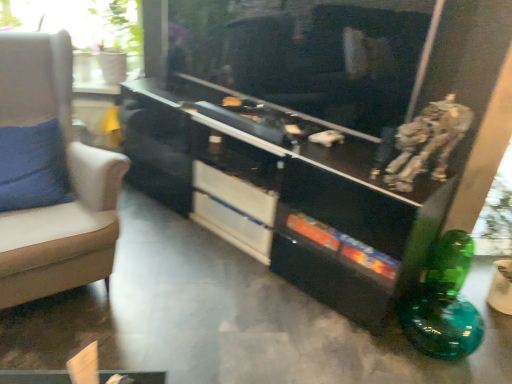
Question: Does white glossy drawer at center, arranged as the first drawer when ordered from the bottom, come in front of metallic silver robot at upper right?

Choices:
 (A) yes
 (B) no

Answer: (B)

Question: From the image's perspective, does white glossy drawer at center, arranged as the first drawer when ordered from the bottom, appear lower than metallic silver robot at upper right?

Choices:
 (A) yes
 (B) no

Answer: (A)

Question: From the image's perspective, is white glossy drawer at center, arranged as the first drawer when ordered from the bottom, located above metallic silver robot at upper right?

Choices:
 (A) no
 (B) yes

Answer: (A)

Question: Can you confirm if white glossy drawer at center, the second drawer viewed from the top, is thinner than metallic silver robot at upper right?

Choices:
 (A) no
 (B) yes

Answer: (B)

Question: Is white glossy drawer at center, arranged as the first drawer when ordered from the bottom, facing towards metallic silver robot at upper right?

Choices:
 (A) no
 (B) yes

Answer: (A)

Question: Does white glossy drawer at center, the second drawer viewed from the top, touch metallic silver robot at upper right?

Choices:
 (A) no
 (B) yes

Answer: (A)

Question: Does white glossy drawer at center, arranged as the 2th drawer when ordered from the bottom, have a lesser width compared to beige fabric chair at left?

Choices:
 (A) no
 (B) yes

Answer: (B)

Question: Is white glossy drawer at center, arranged as the 2th drawer when ordered from the bottom, facing away from beige fabric chair at left?

Choices:
 (A) yes
 (B) no

Answer: (B)

Question: Considering the relative sizes of white glossy drawer at center, which is the first drawer from top to bottom, and beige fabric chair at left in the image provided, is white glossy drawer at center, which is the first drawer from top to bottom, bigger than beige fabric chair at left?

Choices:
 (A) no
 (B) yes

Answer: (A)

Question: Is white glossy drawer at center, arranged as the 2th drawer when ordered from the bottom, not near beige fabric chair at left?

Choices:
 (A) yes
 (B) no

Answer: (B)

Question: Can you confirm if white glossy drawer at center, arranged as the 2th drawer when ordered from the bottom, is smaller than beige fabric chair at left?

Choices:
 (A) no
 (B) yes

Answer: (B)

Question: Is white glossy drawer at center, which is the first drawer from top to bottom, at the right side of beige fabric chair at left?

Choices:
 (A) no
 (B) yes

Answer: (B)

Question: Is transparent glass window at upper left taller than metallic silver robot at upper right?

Choices:
 (A) yes
 (B) no

Answer: (A)